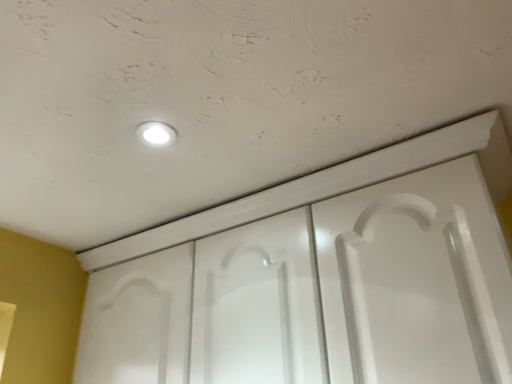
Question: Considering the relative sizes of white glossy light fixture at upper center and white glossy door at center in the image provided, is white glossy light fixture at upper center taller than white glossy door at center?

Choices:
 (A) no
 (B) yes

Answer: (A)

Question: Considering the relative positions of white glossy light fixture at upper center and white glossy door at center in the image provided, is white glossy light fixture at upper center behind white glossy door at center?

Choices:
 (A) no
 (B) yes

Answer: (B)

Question: Can you confirm if white glossy light fixture at upper center is shorter than white glossy door at center?

Choices:
 (A) no
 (B) yes

Answer: (B)

Question: Considering the relative positions of white glossy light fixture at upper center and white glossy door at center in the image provided, is white glossy light fixture at upper center to the right of white glossy door at center from the viewer's perspective?

Choices:
 (A) no
 (B) yes

Answer: (A)

Question: From a real-world perspective, is white glossy light fixture at upper center under white glossy door at center?

Choices:
 (A) yes
 (B) no

Answer: (B)

Question: Is white glossy light fixture at upper center with white glossy door at center?

Choices:
 (A) no
 (B) yes

Answer: (A)

Question: Does white glossy door at center come in front of white glossy light fixture at upper center?

Choices:
 (A) yes
 (B) no

Answer: (A)

Question: Would you consider white glossy door at center to be distant from white glossy light fixture at upper center?

Choices:
 (A) yes
 (B) no

Answer: (B)

Question: Is white glossy door at center oriented away from white glossy light fixture at upper center?

Choices:
 (A) no
 (B) yes

Answer: (A)

Question: Is white glossy door at center behind white glossy light fixture at upper center?

Choices:
 (A) no
 (B) yes

Answer: (A)

Question: Considering the relative positions of white glossy door at center and white glossy light fixture at upper center in the image provided, is white glossy door at center to the left of white glossy light fixture at upper center from the viewer's perspective?

Choices:
 (A) no
 (B) yes

Answer: (A)

Question: Is white glossy door at center to the right of white glossy light fixture at upper center from the viewer's perspective?

Choices:
 (A) no
 (B) yes

Answer: (B)

Question: Is white glossy light fixture at upper center in front of or behind white glossy door at center in the image?

Choices:
 (A) front
 (B) behind

Answer: (B)